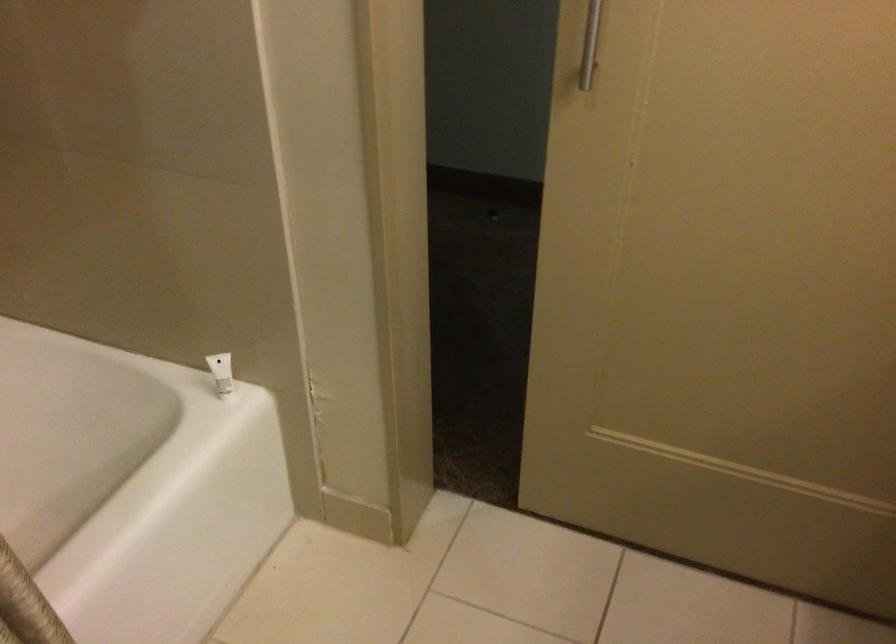
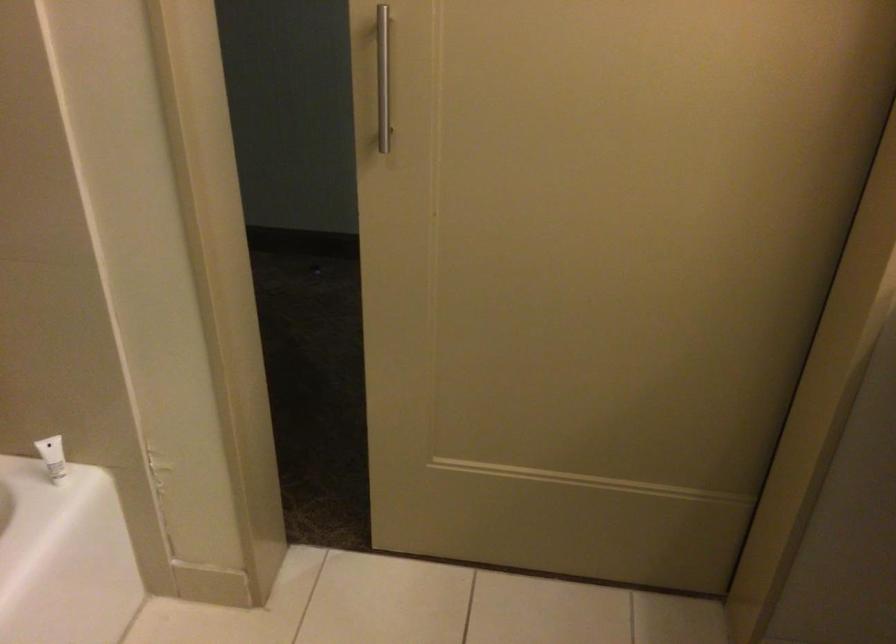
Question: What movement of the cameraman would produce the second image?

Choices:
 (A) Left
 (B) Right
 (C) Forward
 (D) Backward

Answer: (D)